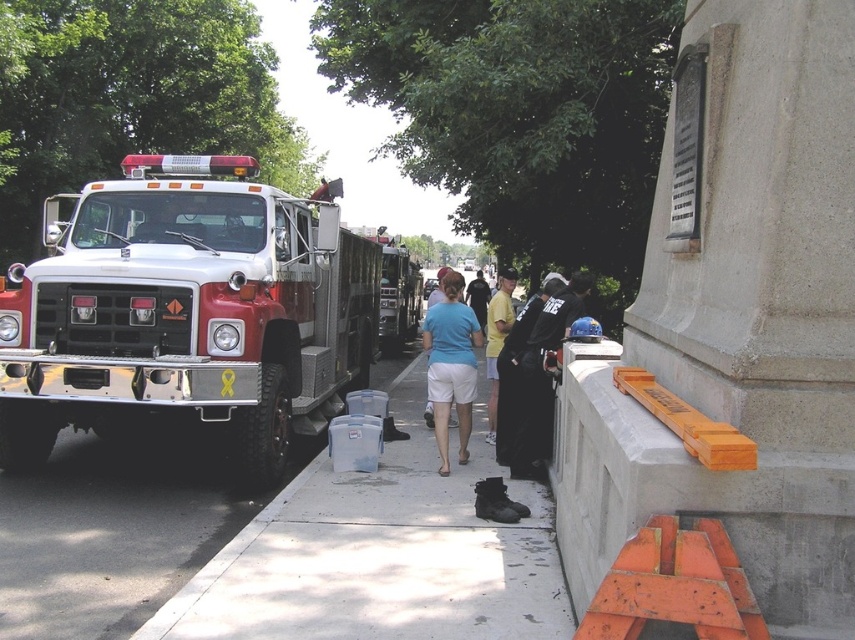
Question: Which point is closer to the camera?

Choices:
 (A) red metallic fire truck at left
 (B) concrete sidewalk at center

Answer: (B)

Question: Is yellow cotton shirt at center to the left of light blue shirt at center from the viewer's perspective?

Choices:
 (A) no
 (B) yes

Answer: (B)

Question: Which point is closer to the camera?

Choices:
 (A) black fabric jacket at center
 (B) light blue shirt at center

Answer: (A)

Question: Which object is the closest to the metallic silver firetruck at center?

Choices:
 (A) concrete sidewalk at center
 (B) yellow cotton shirt at center
 (C) black fabric jacket at center

Answer: (C)

Question: Observing the image, what is the correct spatial positioning of concrete sidewalk at center in reference to metallic silver firetruck at center?

Choices:
 (A) below
 (B) above

Answer: (A)

Question: Observing the image, what is the correct spatial positioning of blue cotton shirt at center in reference to metallic silver firetruck at center?

Choices:
 (A) left
 (B) right

Answer: (B)